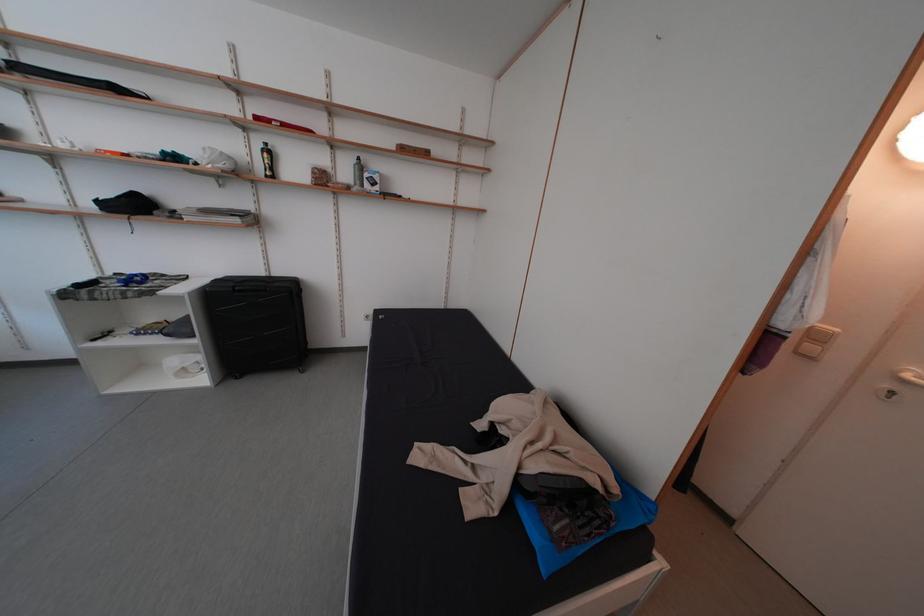
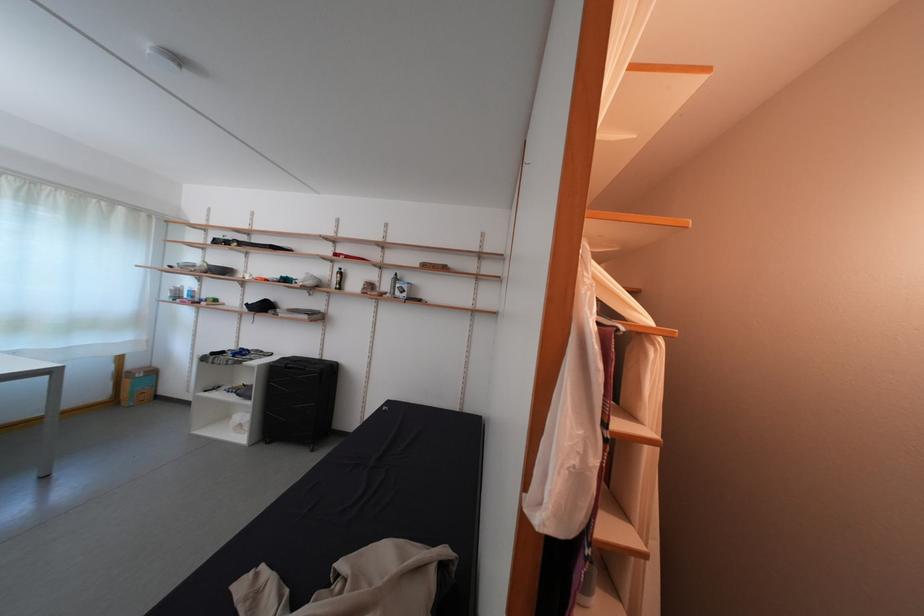
The first image is from the beginning of the video and the second image is from the end. How did the camera likely rotate when shooting the video?

The camera rotated toward left-up.